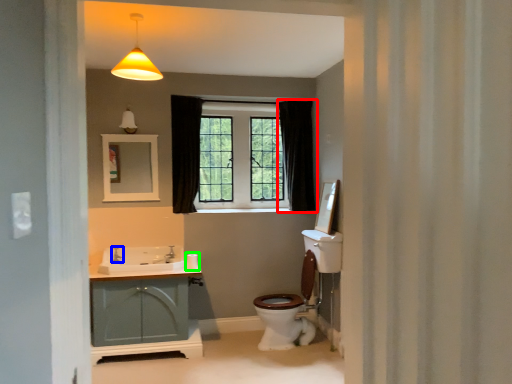
Question: Which object is positioned closest to curtain (highlighted by a red box)? Select from faucet (highlighted by a blue box) and toilet paper (highlighted by a green box).

Choices:
 (A) faucet
 (B) toilet paper

Answer: (B)